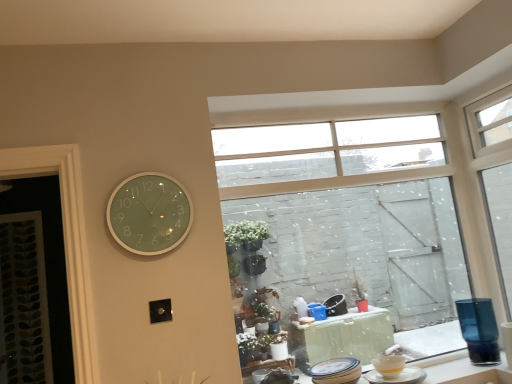
The width and height of the screenshot is (512, 384). Describe the element at coordinates (479, 330) in the screenshot. I see `transparent blue glass at right` at that location.

What do you see at coordinates (336, 371) in the screenshot?
I see `white ceramic plate at lower right, the first tableware in the left-to-right sequence` at bounding box center [336, 371].

This screenshot has width=512, height=384. I want to click on yellow matte bowl at lower right, marked as the second tableware in a left-to-right arrangement, so click(389, 365).

Find the location of a particular element. This screenshot has height=384, width=512. clear glass window at upper right, the 1th window viewed from the right is located at coordinates (495, 176).

Describe the element at coordinates (149, 214) in the screenshot. I see `green glass clock at upper left` at that location.

Identify the location of green glass clock at upper left. (149, 214).

Identify the location of yellow glossy cup at lower right, placed as the first tableware when sorted from right to left. (398, 377).

Measure the distance from green glass clock at upper left to clear glass window at upper center, which is the second window in right-to-left order.

green glass clock at upper left and clear glass window at upper center, which is the second window in right-to-left order, are 6.37 feet apart.

Considering the sizes of objects green glass clock at upper left and clear glass window at upper center, which is the second window in right-to-left order, in the image provided, who is taller, green glass clock at upper left or clear glass window at upper center, which is the second window in right-to-left order,?

clear glass window at upper center, which is the second window in right-to-left order.

Is green glass clock at upper left bigger than clear glass window at upper center, which is the second window in right-to-left order?

Actually, green glass clock at upper left might be smaller than clear glass window at upper center, which is the second window in right-to-left order.

Is green glass clock at upper left looking in the opposite direction of clear glass window at upper center, which is the second window in right-to-left order?

No.

Is the depth of clear glass window at upper center, which is the second window in right-to-left order, less than that of clear glass window at upper right, the 1th window viewed from the right?

No.

Looking at this image, which is more to the right, clear glass window at upper center, which appears as the 1th window when viewed from the left, or clear glass window at upper right, the second window from the left?

clear glass window at upper right, the second window from the left, is more to the right.

From the image's perspective, which is above, clear glass window at upper center, which appears as the 1th window when viewed from the left, or clear glass window at upper right, the 1th window viewed from the right?

clear glass window at upper right, the 1th window viewed from the right, from the image's perspective.

Is yellow matte bowl at lower right, marked as the second tableware in a left-to-right arrangement, oriented away from white ceramic plate at lower right, the first tableware in the left-to-right sequence?

yellow matte bowl at lower right, marked as the second tableware in a left-to-right arrangement, does not have its back to white ceramic plate at lower right, the first tableware in the left-to-right sequence.

Relative to white ceramic plate at lower right, placed as the 3th tableware when sorted from right to left, is yellow matte bowl at lower right, marked as the second tableware in a left-to-right arrangement, in front or behind?

In the image, yellow matte bowl at lower right, marked as the second tableware in a left-to-right arrangement, appears behind white ceramic plate at lower right, placed as the 3th tableware when sorted from right to left.

Image resolution: width=512 pixels, height=384 pixels. There is a white ceramic plate at lower right, placed as the 3th tableware when sorted from right to left. Find the location of `the 1st tableware below it (from a real-world perspective)`. the 1st tableware below it (from a real-world perspective) is located at coordinates (389, 365).

Are yellow matte bowl at lower right, placed as the second tableware when sorted from right to left, and white ceramic plate at lower right, the first tableware in the left-to-right sequence, making contact?

No, yellow matte bowl at lower right, placed as the second tableware when sorted from right to left, is not beside white ceramic plate at lower right, the first tableware in the left-to-right sequence.

Can you tell me how much green glass clock at upper left and clear glass window at upper right, the 1th window viewed from the right, differ in facing direction?

green glass clock at upper left and clear glass window at upper right, the 1th window viewed from the right, are facing 89.8 degrees away from each other.

Is green glass clock at upper left oriented towards clear glass window at upper right, the 1th window viewed from the right?

No, green glass clock at upper left is not turned towards clear glass window at upper right, the 1th window viewed from the right.

Is point (143, 203) less distant than point (476, 105)?

Yes, it is.

Consider the image. Are green glass clock at upper left and clear glass window at upper right, the second window from the left, making contact?

They are not placed beside each other.

Can you confirm if yellow glossy cup at lower right, placed as the first tableware when sorted from right to left, is shorter than white ceramic plate at lower right, placed as the 3th tableware when sorted from right to left?

Yes, yellow glossy cup at lower right, placed as the first tableware when sorted from right to left, is shorter than white ceramic plate at lower right, placed as the 3th tableware when sorted from right to left.

From the image's perspective, is yellow glossy cup at lower right, arranged as the third tableware when viewed from the left, located above white ceramic plate at lower right, the first tableware in the left-to-right sequence?

No, from the image's perspective, yellow glossy cup at lower right, arranged as the third tableware when viewed from the left, is not above white ceramic plate at lower right, the first tableware in the left-to-right sequence.

Considering their positions, is yellow glossy cup at lower right, arranged as the third tableware when viewed from the left, located in front of or behind white ceramic plate at lower right, the first tableware in the left-to-right sequence?

yellow glossy cup at lower right, arranged as the third tableware when viewed from the left, is positioned farther from the viewer than white ceramic plate at lower right, the first tableware in the left-to-right sequence.

Based on the photo, considering the relative sizes of green glass clock at upper left and transparent blue glass at right in the image provided, is green glass clock at upper left wider than transparent blue glass at right?

No, green glass clock at upper left is not wider than transparent blue glass at right.

Is point (127, 248) closer or farther from the camera than point (480, 360)?

Point (127, 248).

From the picture: From a real-world perspective, which is physically below, green glass clock at upper left or transparent blue glass at right?

transparent blue glass at right is physically lower.

Is green glass clock at upper left to the left or to the right of transparent blue glass at right in the image?

From the image, it's evident that green glass clock at upper left is to the left of transparent blue glass at right.

Which is more to the left, transparent blue glass at right or clear glass window at upper right, the second window from the left?

From the viewer's perspective, transparent blue glass at right appears more on the left side.

Does transparent blue glass at right have a larger size compared to clear glass window at upper right, the second window from the left?

No, transparent blue glass at right is not bigger than clear glass window at upper right, the second window from the left.

Identify the location of window lying on the right of transparent blue glass at right. (495, 176).

Is point (482, 303) closer to viewer compared to point (490, 199)?

No, it is not.

Image resolution: width=512 pixels, height=384 pixels. What are the coordinates of `wall clock above the clear glass window at upper center, which appears as the 1th window when viewed from the left (from a real-world perspective)` in the screenshot? It's located at (149, 214).

Where is `window above the clear glass window at upper center, which appears as the 1th window when viewed from the left (from the image's perspective)`? window above the clear glass window at upper center, which appears as the 1th window when viewed from the left (from the image's perspective) is located at coordinates (495, 176).

Estimate the real-world distances between objects in this image. Which object is further from yellow glossy cup at lower right, placed as the first tableware when sorted from right to left, white ceramic plate at lower right, the first tableware in the left-to-right sequence, or yellow matte bowl at lower right, placed as the second tableware when sorted from right to left?

white ceramic plate at lower right, the first tableware in the left-to-right sequence, lies further to yellow glossy cup at lower right, placed as the first tableware when sorted from right to left, than the other object.

When comparing their distances from clear glass window at upper center, which appears as the 1th window when viewed from the left, does yellow matte bowl at lower right, placed as the second tableware when sorted from right to left, or white ceramic plate at lower right, placed as the 3th tableware when sorted from right to left, seem further?

yellow matte bowl at lower right, placed as the second tableware when sorted from right to left.

Based on their spatial positions, is yellow glossy cup at lower right, arranged as the third tableware when viewed from the left, or clear glass window at upper center, which is the second window in right-to-left order, closer to yellow matte bowl at lower right, placed as the second tableware when sorted from right to left?

Based on the image, yellow glossy cup at lower right, arranged as the third tableware when viewed from the left, appears to be nearer to yellow matte bowl at lower right, placed as the second tableware when sorted from right to left.

From the image, which object appears to be nearer to transparent blue glass at right, yellow glossy cup at lower right, arranged as the third tableware when viewed from the left, or green glass clock at upper left?

yellow glossy cup at lower right, arranged as the third tableware when viewed from the left, is closer to transparent blue glass at right.

Estimate the real-world distances between objects in this image. Which object is closer to yellow matte bowl at lower right, placed as the second tableware when sorted from right to left, clear glass window at upper center, which is the second window in right-to-left order, or transparent blue glass at right?

The object closer to yellow matte bowl at lower right, placed as the second tableware when sorted from right to left, is transparent blue glass at right.

Looking at the image, which one is located closer to yellow glossy cup at lower right, arranged as the third tableware when viewed from the left, white ceramic plate at lower right, the first tableware in the left-to-right sequence, or clear glass window at upper center, which appears as the 1th window when viewed from the left?

Based on the image, white ceramic plate at lower right, the first tableware in the left-to-right sequence, appears to be nearer to yellow glossy cup at lower right, arranged as the third tableware when viewed from the left.

Estimate the real-world distances between objects in this image. Which object is closer to yellow glossy cup at lower right, arranged as the third tableware when viewed from the left, clear glass window at upper center, which is the second window in right-to-left order, or transparent blue glass at right?

transparent blue glass at right is closer to yellow glossy cup at lower right, arranged as the third tableware when viewed from the left.

Based on their spatial positions, is transparent blue glass at right or green glass clock at upper left further from clear glass window at upper center, which is the second window in right-to-left order?

The object further to clear glass window at upper center, which is the second window in right-to-left order, is green glass clock at upper left.

Identify the location of window located between green glass clock at upper left and clear glass window at upper right, the 1th window viewed from the right, in the left-right direction. pos(365,218).

Identify the location of glass vase between clear glass window at upper right, the second window from the left, and yellow glossy cup at lower right, placed as the first tableware when sorted from right to left, from top to bottom. (479, 330).

Where is `window between green glass clock at upper left and yellow matte bowl at lower right, placed as the second tableware when sorted from right to left, from left to right`? window between green glass clock at upper left and yellow matte bowl at lower right, placed as the second tableware when sorted from right to left, from left to right is located at coordinates (365, 218).

At what (x,y) coordinates should I click in order to perform the action: click on tableware between green glass clock at upper left and yellow matte bowl at lower right, placed as the second tableware when sorted from right to left. Please return your answer as a coordinate pair (x, y). Looking at the image, I should click on (336, 371).